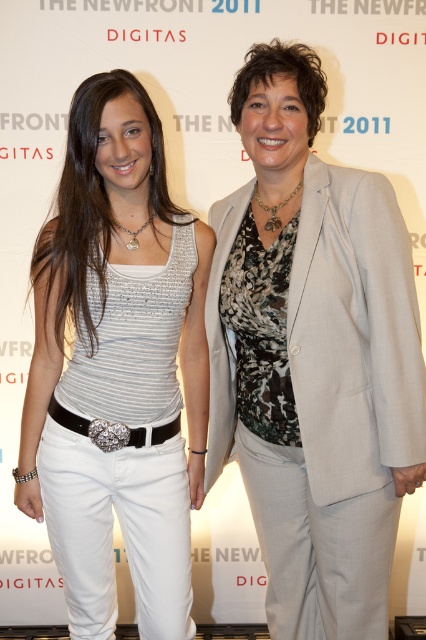
Does white matte pants at left have a larger size compared to light gray fabric business suit at center?

Yes, white matte pants at left is bigger than light gray fabric business suit at center.

Is white matte pants at left wider than light gray fabric business suit at center?

Indeed, white matte pants at left has a greater width compared to light gray fabric business suit at center.

I want to click on white matte pants at left, so click(x=118, y=369).

The width and height of the screenshot is (426, 640). I want to click on white matte pants at left, so click(x=118, y=369).